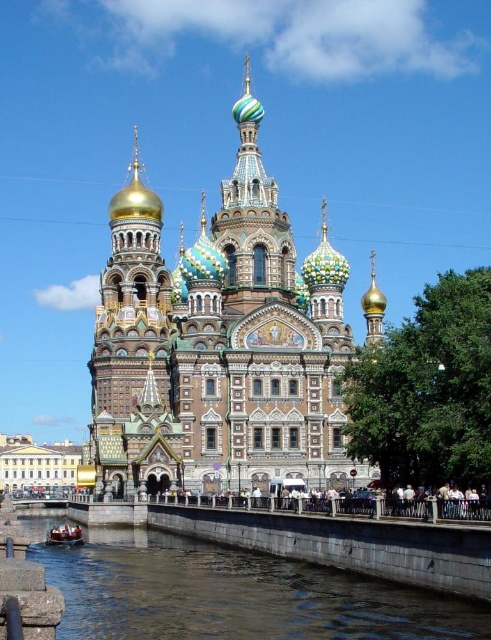
You are a photographer planning to capture the gold mosaic church at center and the metallic polished boat at lower left in a single shot. Considering their sizes, which object should you focus on to ensure both are visible in the frame without cropping?

The gold mosaic church at center is much taller than the metallic polished boat at lower left, so you should focus on the gold mosaic church at center to ensure both are visible in the frame without cropping.

You are standing on a bridge overlooking the canal and want to take a photo of the gold mosaic church at center and the clear water at lower center. If you want to capture both objects in the frame, which one should you focus on to ensure both are visible?

You should focus on the gold mosaic church at center because it might be wider than the clear water at lower center, so centering the church would allow the water to fit into the frame as well.